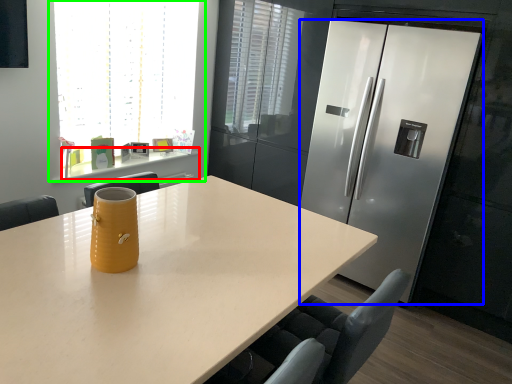
Question: Based on their relative distances, which object is nearer to counter (highlighted by a red box)? Choose from refrigerator (highlighted by a blue box) and window (highlighted by a green box).

Choices:
 (A) refrigerator
 (B) window

Answer: (B)